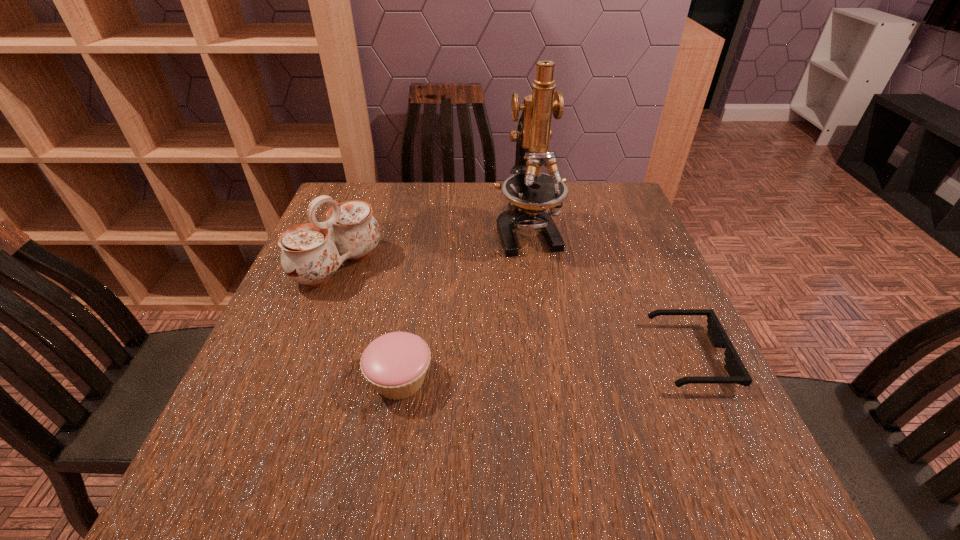
Where is `free region at the near edge of the desktop`? This screenshot has width=960, height=540. free region at the near edge of the desktop is located at coordinates (373, 404).

Where is `vacant area at the right edge of the desktop`? This screenshot has height=540, width=960. vacant area at the right edge of the desktop is located at coordinates (636, 258).

I want to click on vacant area at the near left corner of the desktop, so click(x=239, y=419).

Locate an element on the screen. The width and height of the screenshot is (960, 540). vacant region at the far right corner of the desktop is located at coordinates (584, 204).

Image resolution: width=960 pixels, height=540 pixels. What are the coordinates of `blank region between the third tallest object and the microscope` in the screenshot? It's located at (463, 305).

Find the location of a particular element. free spot between the tallest object and the cupcake is located at coordinates (463, 305).

Locate an element on the screen. Image resolution: width=960 pixels, height=540 pixels. vacant space that is in between the sunglasses and the leftmost object is located at coordinates (515, 311).

This screenshot has width=960, height=540. I want to click on unoccupied area between the microscope and the shortest object, so click(609, 294).

Locate an element on the screen. The image size is (960, 540). vacant region between the leftmost object and the microscope is located at coordinates (432, 248).

You are a GUI agent. You are given a task and a screenshot of the screen. Output one action in this format:
    pyautogui.click(x=<x>, y=<y>)
    Task: Click on the free space between the microscope and the third tallest object
    The width and height of the screenshot is (960, 540).
    Given the screenshot: What is the action you would take?
    pyautogui.click(x=463, y=305)